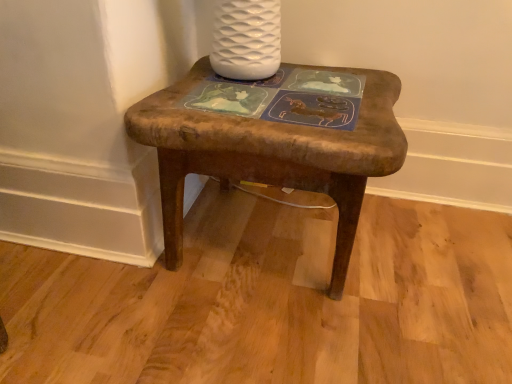
In order to face rustic wood stool at center, should I rotate leftwards or rightwards?

Turn right approximately 2.009 degrees to face it.

What do you see at coordinates (270, 153) in the screenshot? I see `rustic wood stool at center` at bounding box center [270, 153].

Where is `rustic wood stool at center`? The height and width of the screenshot is (384, 512). rustic wood stool at center is located at coordinates (270, 153).

Identify the location of rustic wood stool at center. (270, 153).